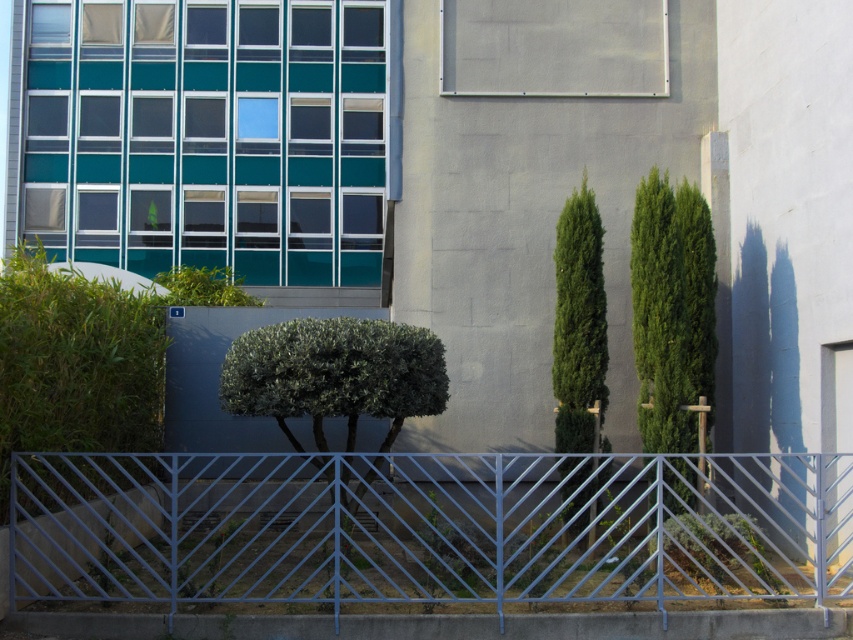
Between green leafy hedge at left and green leafy bush at center, which one has more height?

With more height is green leafy hedge at left.

Locate an element on the screen. Image resolution: width=853 pixels, height=640 pixels. green leafy hedge at left is located at coordinates (74, 364).

Between green leafy bush at center and green leafy tree at center right, which one is positioned higher?

green leafy tree at center right

Consider the image. Who is positioned more to the left, green leafy bush at center or green leafy tree at center right?

From the viewer's perspective, green leafy bush at center appears more on the left side.

Describe the element at coordinates (334, 374) in the screenshot. I see `green leafy bush at center` at that location.

Identify the location of green leafy bush at center. This screenshot has width=853, height=640. (334, 374).

Where is `metallic blue fence at center`? This screenshot has height=640, width=853. metallic blue fence at center is located at coordinates (424, 528).

Who is more distant from viewer, (717, 484) or (39, 310)?

Positioned behind is point (717, 484).

The height and width of the screenshot is (640, 853). Find the location of `metallic blue fence at center`. metallic blue fence at center is located at coordinates (424, 528).